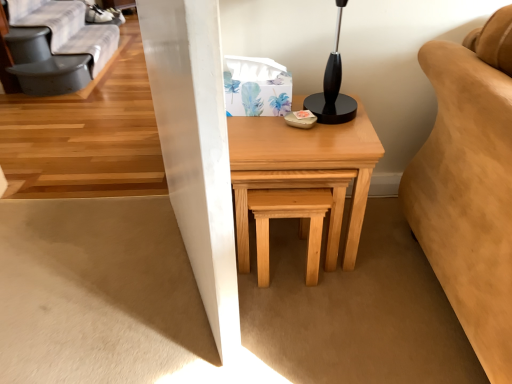
The image size is (512, 384). What are the coordinates of `free spot to the right of natural wood stool at center` in the screenshot? It's located at tap(364, 271).